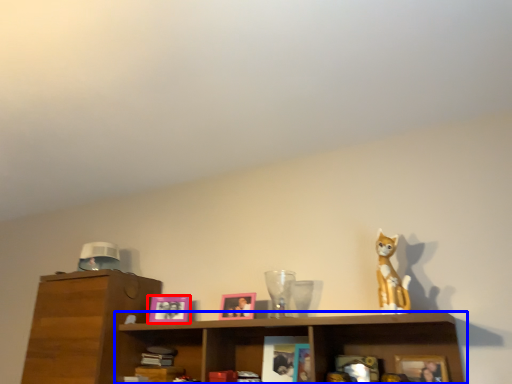
Question: Which object appears closest to the camera in this image, picture frame (highlighted by a red box) or shelf (highlighted by a blue box)?

Choices:
 (A) picture frame
 (B) shelf

Answer: (B)